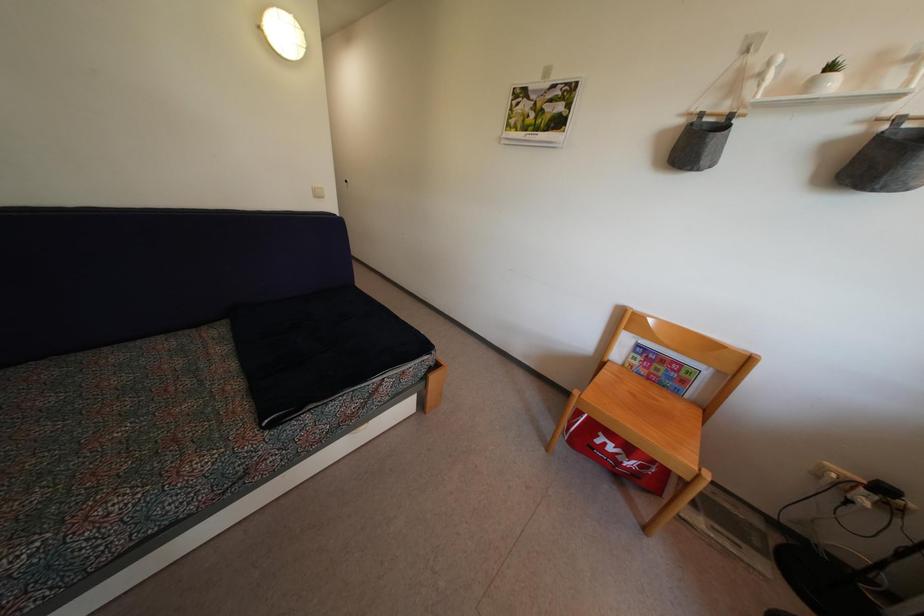
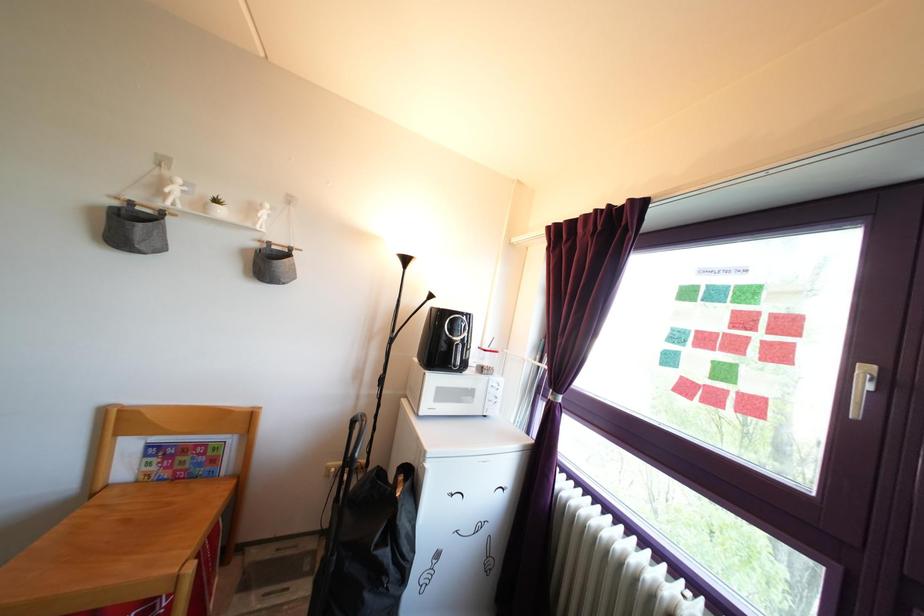
Where in the second image is the point corresponding to [833,76] from the first image?

(219, 209)